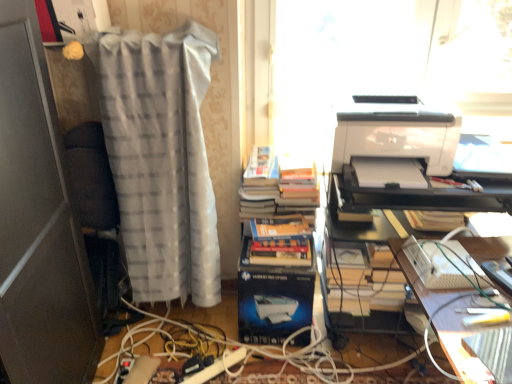
Question: Is white glossy printer at upper right bigger or smaller than white glossy printer at right?

Choices:
 (A) big
 (B) small

Answer: (A)

Question: Is white glossy printer at upper right situated inside white glossy printer at right or outside?

Choices:
 (A) inside
 (B) outside

Answer: (B)

Question: Estimate the real-world distances between objects in this image. Which object is closer to the metallic silver remote control at lower right, which appears as the 1th equipment when viewed from the right?

Choices:
 (A) blue glossy paperback book at center
 (B) wooden desk at lower right
 (C) hardcover books at center
 (D) white plastic keyboard at lower right, which ranks as the 2th equipment in right-to-left order
 (E) white glossy printer at upper right

Answer: (D)

Question: Which of these objects is positioned closest to the white plastic cable at lower center?

Choices:
 (A) white glossy printer at upper right
 (B) white plastic keyboard at lower right, the first equipment in the left-to-right sequence
 (C) hardcover books at center
 (D) white sheer curtain at left
 (E) blue glossy paperback book at center

Answer: (E)